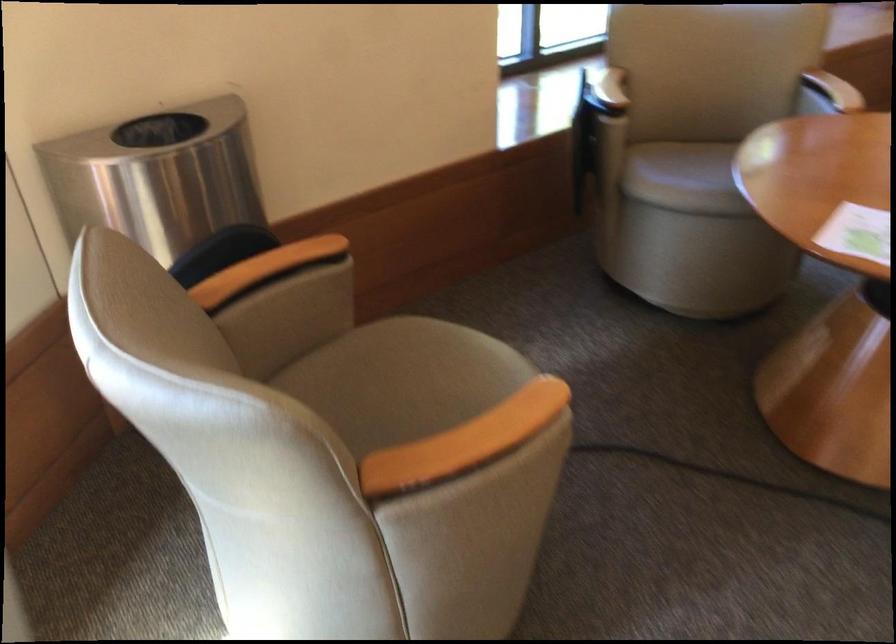
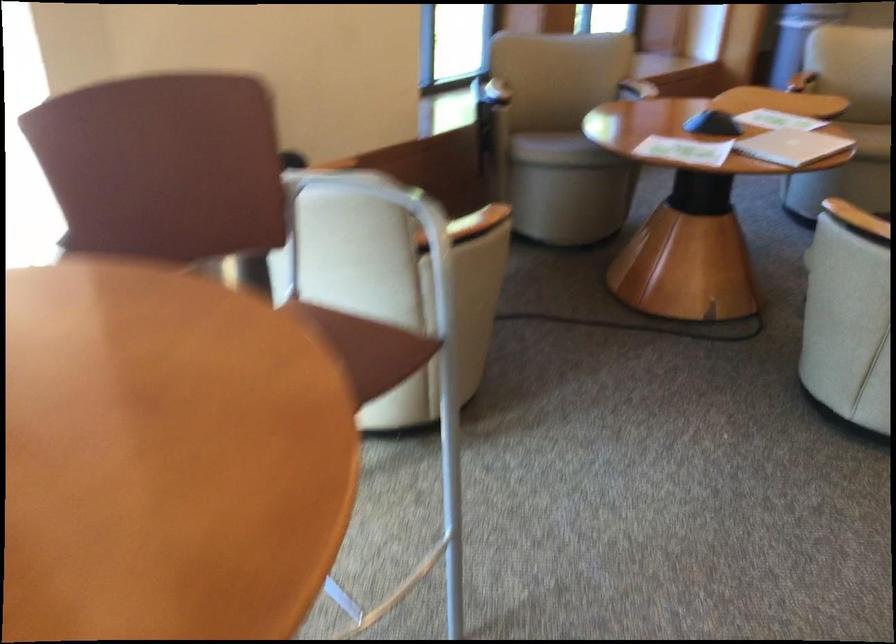
Find the pixel in the second image that matches (x=315, y=252) in the first image.

(333, 164)